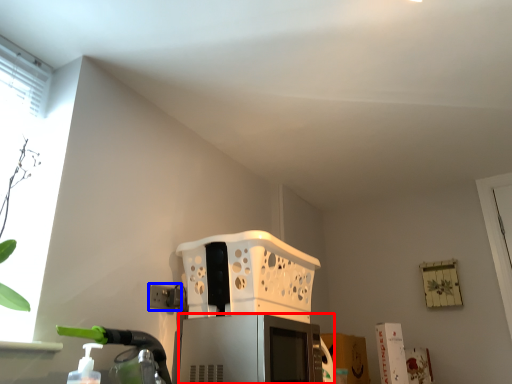
Question: Which object is closer to the camera taking this photo, appliance (highlighted by a red box) or electric outlet (highlighted by a blue box)?

Choices:
 (A) appliance
 (B) electric outlet

Answer: (A)